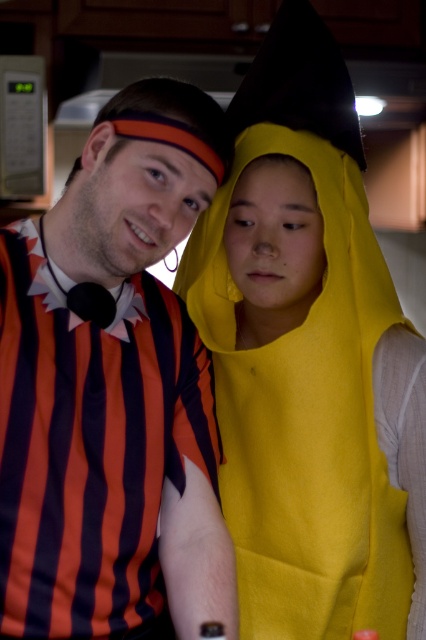
Is point (264, 435) in front of point (126, 147)?

That is False.

Between point (221, 244) and point (166, 381), which one is positioned in front?

Point (166, 381) is more forward.

This screenshot has width=426, height=640. I want to click on yellow felt costume at center, so click(x=310, y=358).